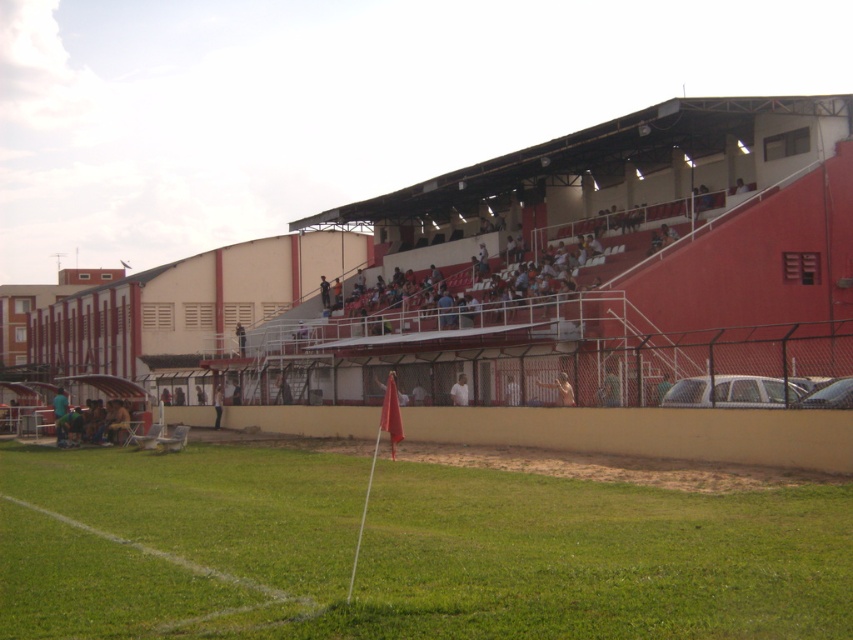
You are a photographer standing at the edge of the grassy field in the stadium. You want to take a photo that includes both the red plastic stadium at upper center and the smooth skin person at center. Which object will appear larger in your photo?

The red plastic stadium at upper center will appear larger in the photo because it is closer to the viewer than the smooth skin person at center.

You are standing at the center of the grassy field and want to locate the red plastic stadium at upper center. According to the coordinates provided, in which direction should you look to find it?

The red plastic stadium at upper center is located at coordinates point (590, 260). Since the Y coordinate is 0.693, which is above 0.5, you should look upward to find it.